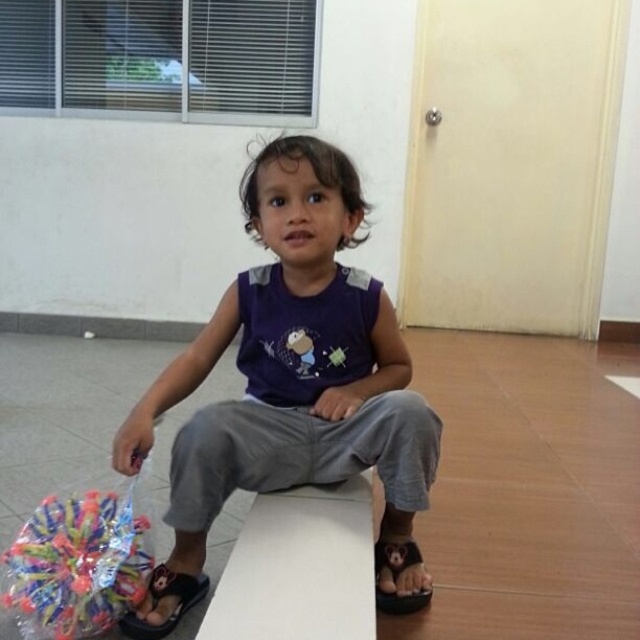
You are a fashion designer observing the child in the image. You need to determine which item of clothing is taller between the purple cotton shirt at center and the black rubber sandal at lower left. Which one is taller?

The purple cotton shirt at center is taller than the black rubber sandal at lower left according to the description.

You are a tailor measuring the width of clothing items in the image. The purple cotton shirt at center and the translucent plastic toy at lower left are both in front of the light beige tiles. Which item would require a wider measurement tape to accurately measure their widths?

The purple cotton shirt at center might be wider than translucent plastic toy at lower left, so the tailor would need a wider measurement tape for the purple cotton shirt at center.

You are a photographer trying to capture the purple cotton shirt at center and the translucent plastic toy at lower left in the same frame. Which object should you focus on first to ensure both are in focus?

The photographer should focus on the purple cotton shirt at center first since it is closer to the viewer than the translucent plastic toy at lower left, ensuring both will be in focus when focusing on the closer object.